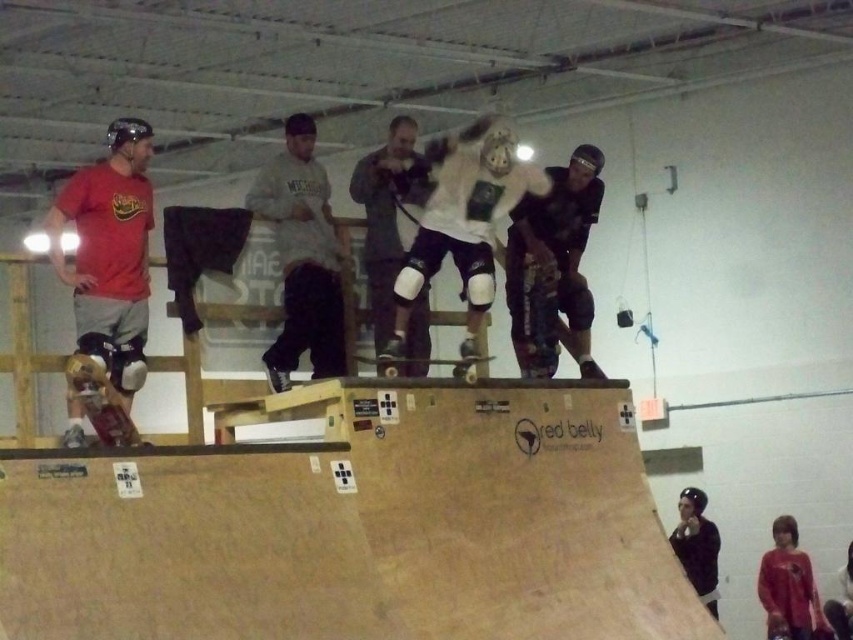
Which is more to the right, white matte helmet at center or white matte knee pads at center?

white matte helmet at center

How distant is white matte helmet at center from white matte knee pads at center?

white matte helmet at center and white matte knee pads at center are 28.36 inches apart.

Does point (445, 164) come closer to viewer compared to point (369, 209)?

Yes, point (445, 164) is closer to viewer.

The height and width of the screenshot is (640, 853). What are the coordinates of `white matte helmet at center` in the screenshot? It's located at (461, 220).

Who is lower down, matte red t-shirt at left or wooden skateboard at center?

wooden skateboard at center

This screenshot has height=640, width=853. What do you see at coordinates (109, 253) in the screenshot?
I see `matte red t-shirt at left` at bounding box center [109, 253].

Where is `matte red t-shirt at left`? matte red t-shirt at left is located at coordinates (109, 253).

Who is lower down, matte red t-shirt at left or wooden textured skateboard at center?

wooden textured skateboard at center is lower down.

Which is in front, point (76, 408) or point (546, 362)?

Point (76, 408) is in front.

Describe the element at coordinates (109, 253) in the screenshot. I see `matte red t-shirt at left` at that location.

Locate an element on the screen. Image resolution: width=853 pixels, height=640 pixels. matte red t-shirt at left is located at coordinates (109, 253).